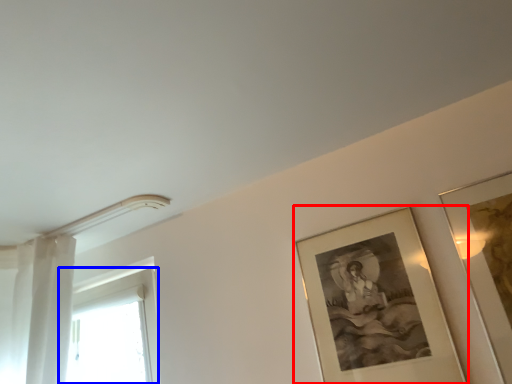
Question: Which object is further to the camera taking this photo, picture frame (highlighted by a red box) or window (highlighted by a blue box)?

Choices:
 (A) picture frame
 (B) window

Answer: (B)